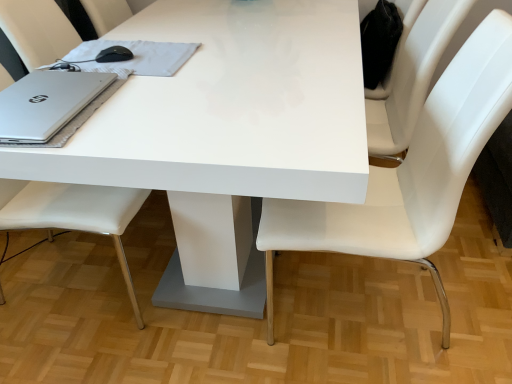
Where is `vacant space in front of satin silver notebook at upper left`? The width and height of the screenshot is (512, 384). vacant space in front of satin silver notebook at upper left is located at coordinates (150, 102).